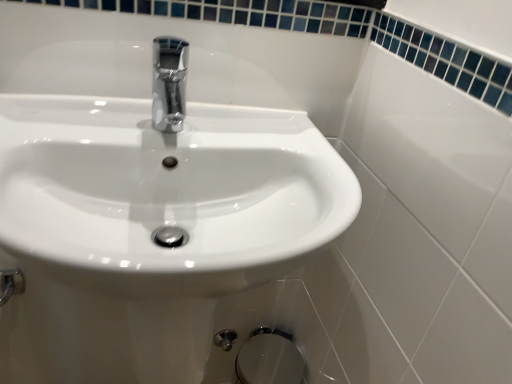
In order to click on free spot to the left of chrome metallic faucet at center in this screenshot , I will do `click(86, 123)`.